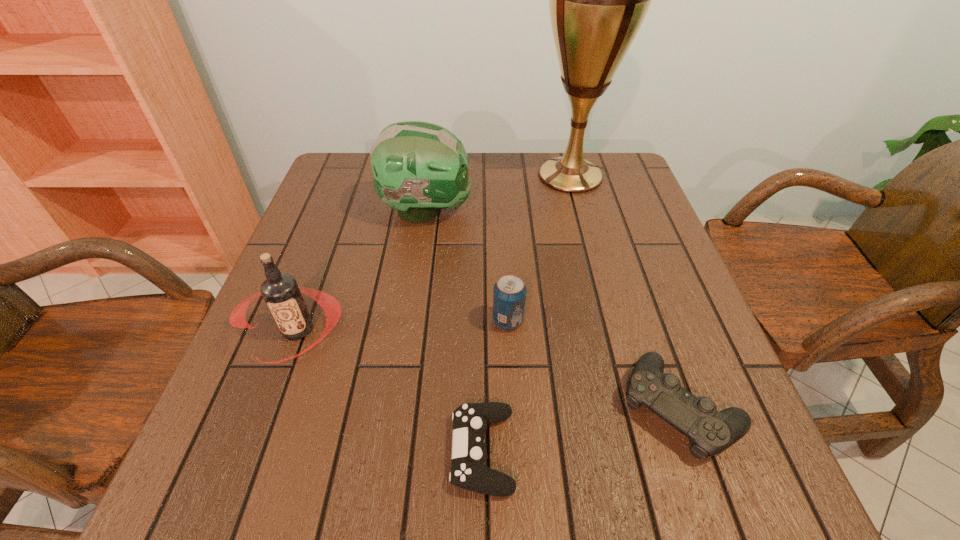
The width and height of the screenshot is (960, 540). Find the location of `vacant space located 0.100m on the visor of the fifth shortest object`. vacant space located 0.100m on the visor of the fifth shortest object is located at coordinates (511, 211).

Identify the location of vacant space located on the label of the fourth shortest object. (250, 461).

Where is `free region located on the front of the fourth tallest object`? The image size is (960, 540). free region located on the front of the fourth tallest object is located at coordinates (510, 359).

This screenshot has height=540, width=960. Find the location of `vacant space located on the back of the right control`. vacant space located on the back of the right control is located at coordinates (625, 252).

Find the location of a particular element. The image size is (960, 540). vacant area situated on the surface of the shortest object is located at coordinates (279, 451).

Locate an element on the screen. The height and width of the screenshot is (540, 960). free space located on the surface of the shortest object is located at coordinates (216, 451).

The height and width of the screenshot is (540, 960). I want to click on blank area located on the surface of the shortest object, so (407, 451).

I want to click on trophy cup that is at the far edge, so click(x=598, y=0).

The height and width of the screenshot is (540, 960). Find the location of `football helmet present at the far edge`. football helmet present at the far edge is located at coordinates (419, 168).

Where is `object at the left edge`? object at the left edge is located at coordinates (281, 293).